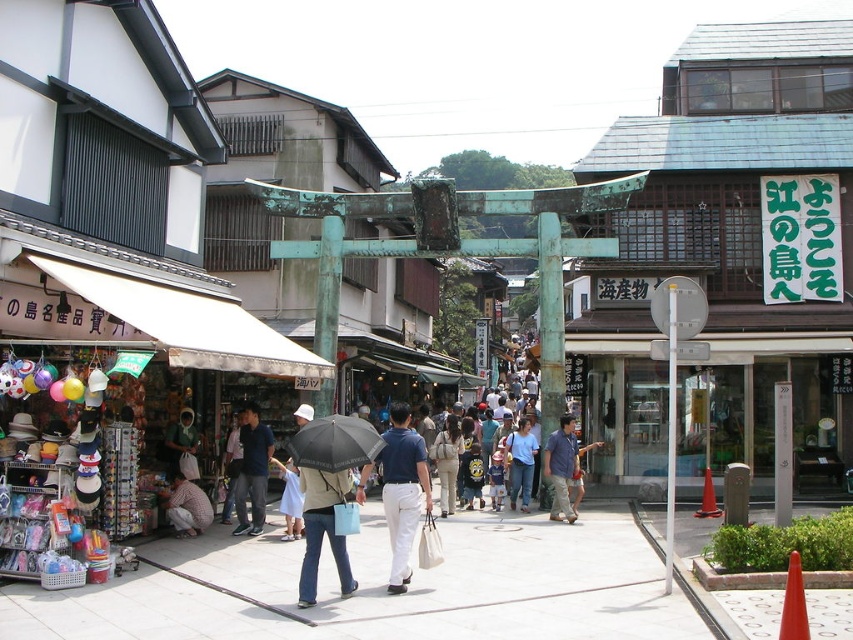
Question: Can you confirm if white concrete pavement at center is bigger than black matte umbrella at center?

Choices:
 (A) no
 (B) yes

Answer: (B)

Question: Which point is farther to the camera?

Choices:
 (A) matte blue shirt at center
 (B) plaid shirt at center

Answer: (B)

Question: Does matte blue shirt at center have a lesser width compared to dark blue shirt at center?

Choices:
 (A) no
 (B) yes

Answer: (A)

Question: In this image, where is black matte umbrella at center located relative to denim jacket at center?

Choices:
 (A) right
 (B) left

Answer: (B)

Question: Estimate the real-world distances between objects in this image. Which object is farther from the dark blue shirt at center?

Choices:
 (A) white concrete pavement at center
 (B) denim jacket at center

Answer: (B)

Question: Estimate the real-world distances between objects in this image. Which object is closer to the matte blue shirt at center?

Choices:
 (A) plaid shirt at center
 (B) white concrete pavement at center
 (C) denim jacket at center

Answer: (B)